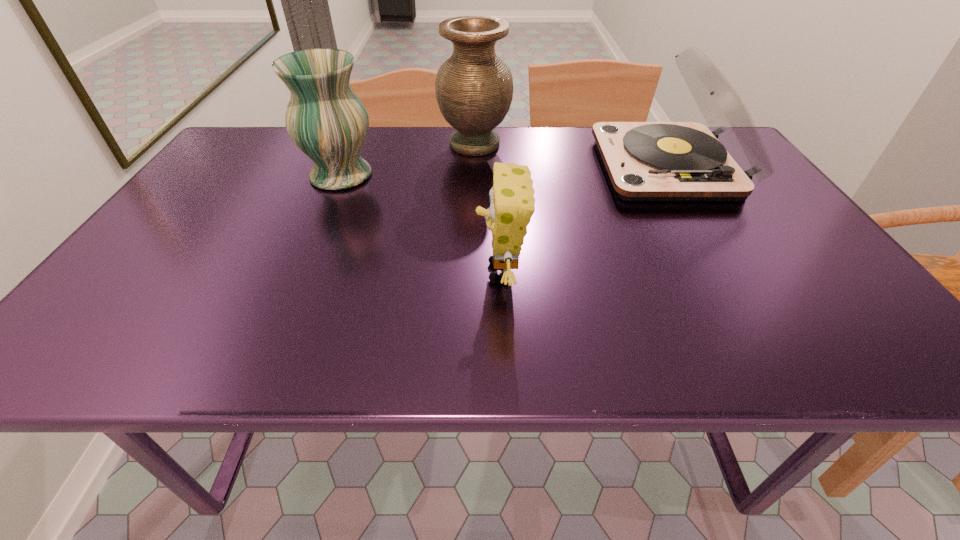
Find the location of a particular element. The width and height of the screenshot is (960, 540). vacant space located on the face of the nearest object is located at coordinates [437, 272].

Where is `vacant space positioned on the face of the nearest object`? Image resolution: width=960 pixels, height=540 pixels. vacant space positioned on the face of the nearest object is located at coordinates (417, 272).

This screenshot has width=960, height=540. Find the location of `vacant space positioned 0.130m on the face of the nearest object`. vacant space positioned 0.130m on the face of the nearest object is located at coordinates (412, 272).

The image size is (960, 540). In order to click on record player located in the far edge section of the desktop in this screenshot , I will do `click(646, 161)`.

You are a GUI agent. You are given a task and a screenshot of the screen. Output one action in this format:
    pyautogui.click(x=<x>, y=<y>)
    Task: Click on the object present at the near edge
    Image resolution: width=960 pixels, height=540 pixels.
    Given the screenshot: What is the action you would take?
    pyautogui.click(x=512, y=204)

Locate an element on the screen. The image size is (960, 540). object that is positioned at the right edge is located at coordinates (646, 161).

Locate an element on the screen. The width and height of the screenshot is (960, 540). object that is at the far right corner is located at coordinates (646, 161).

At what (x,y) coordinates should I click in order to perform the action: click on vacant space at the far edge of the desktop. Please return your answer as a coordinate pair (x, y). Looking at the image, I should click on (408, 131).

Where is `vacant space at the near edge`? This screenshot has height=540, width=960. vacant space at the near edge is located at coordinates (418, 366).

Locate an element on the screen. The width and height of the screenshot is (960, 540). free space at the left edge is located at coordinates (206, 199).